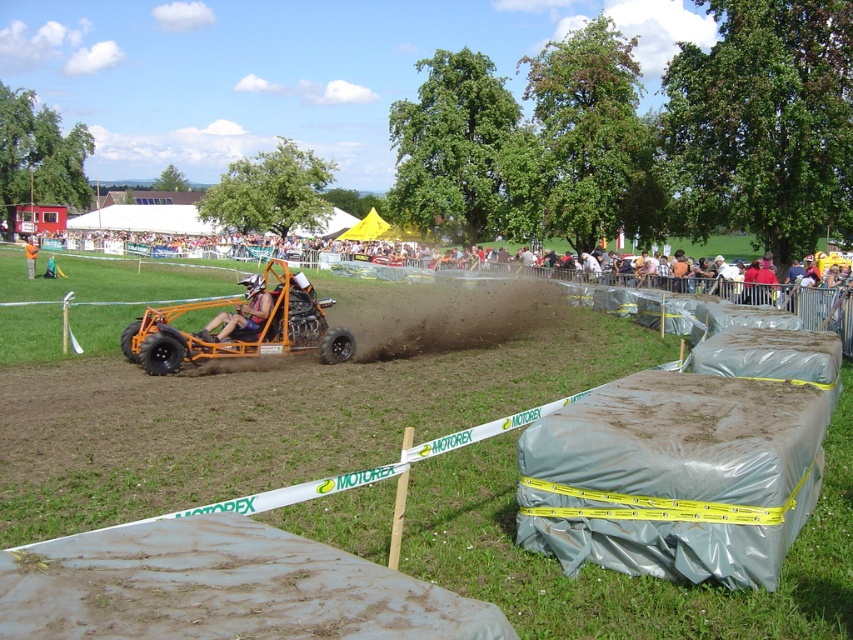
You are a race official at the go kart race and need to place a new safety barrier exactly at the same coordinates as the gray plastic barrier at center. What are the coordinates where you should place the new barrier?

The gray plastic barrier at center is located at coordinates point (254, 394). You should place the new safety barrier at the same coordinates, point (254, 394).

You are a safety inspector at the event and need to ensure that the gray plastic barrier at center is not obstructing the view of the orange fabric person at center. Based on the scene description, is the barrier blocking their view?

The gray plastic barrier at center is positioned under orange fabric person at center, so it is unlikely to block their view as it is below them.